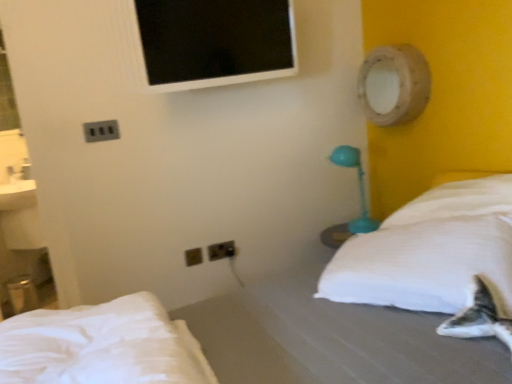
Question: Is teal plastic table lamp at right situated inside white soft pillow at right or outside?

Choices:
 (A) inside
 (B) outside

Answer: (B)

Question: Is teal plastic table lamp at right wider or thinner than white soft pillow at right?

Choices:
 (A) thin
 (B) wide

Answer: (A)

Question: Based on their relative distances, which object is farther from the white fabric bed at center, positioned as the 2th bed in top-to-bottom order?

Choices:
 (A) metallic socket at upper left, the third electric outlet positioned from the back
 (B) white soft bed at lower left, placed as the 2th bed when sorted from bottom to top
 (C) black plastic outlet at lower center, the 3th electric outlet positioned from the front
 (D) black plastic electric outlet at lower center, positioned as the first electric outlet in bottom-to-top order
 (E) wooden round mirror at upper right

Answer: (A)

Question: Which object is positioned farthest from the wooden round mirror at upper right?

Choices:
 (A) black plastic electric outlet at lower center, positioned as the first electric outlet in bottom-to-top order
 (B) white fabric bed at center, positioned as the 2th bed in top-to-bottom order
 (C) metallic socket at upper left, the third electric outlet positioned from the back
 (D) white soft bed at lower left, which ranks as the 1th bed in top-to-bottom order
 (E) black plastic outlet at lower center, marked as the third electric outlet in a left-to-right arrangement

Answer: (D)